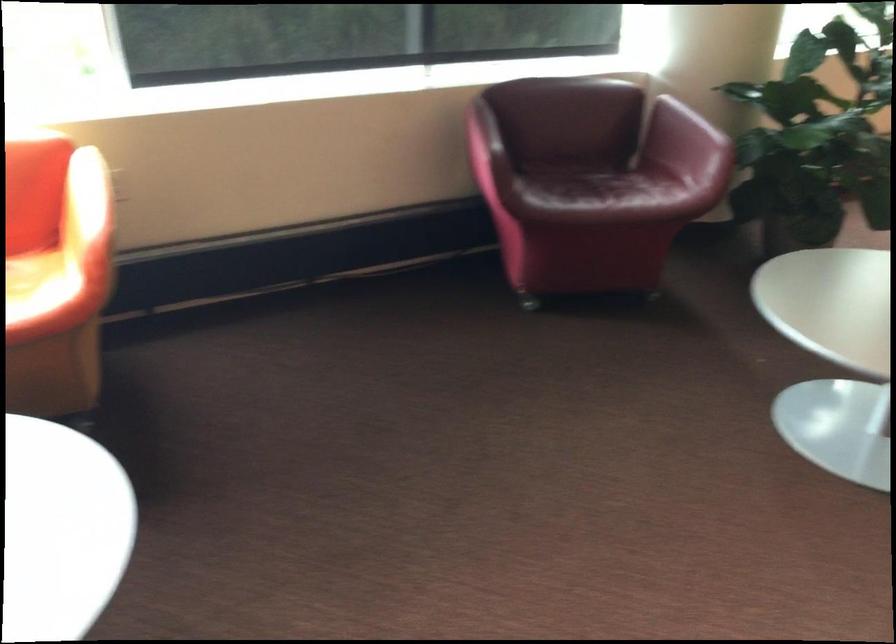
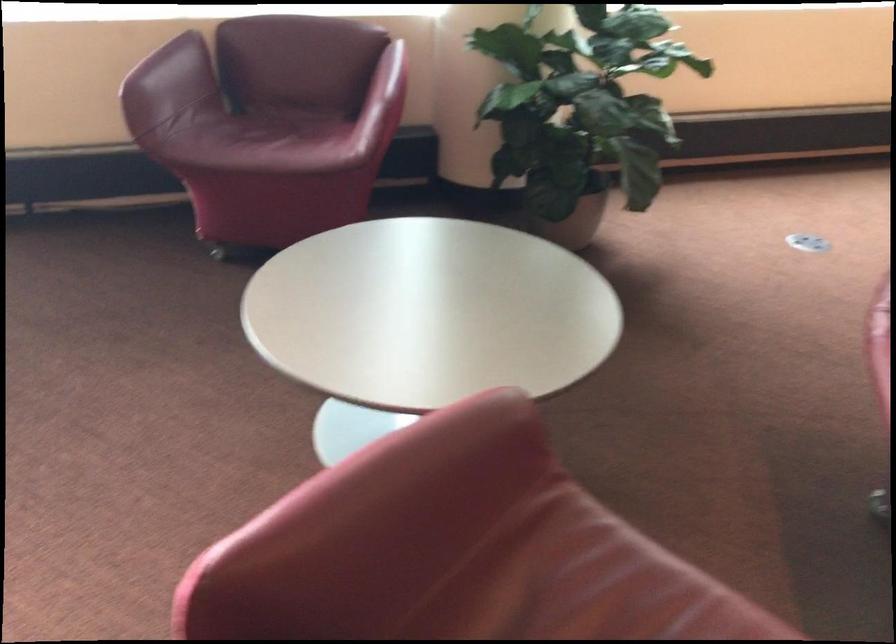
In the second image, find the point that corresponds to [589,190] in the first image.

(263, 140)